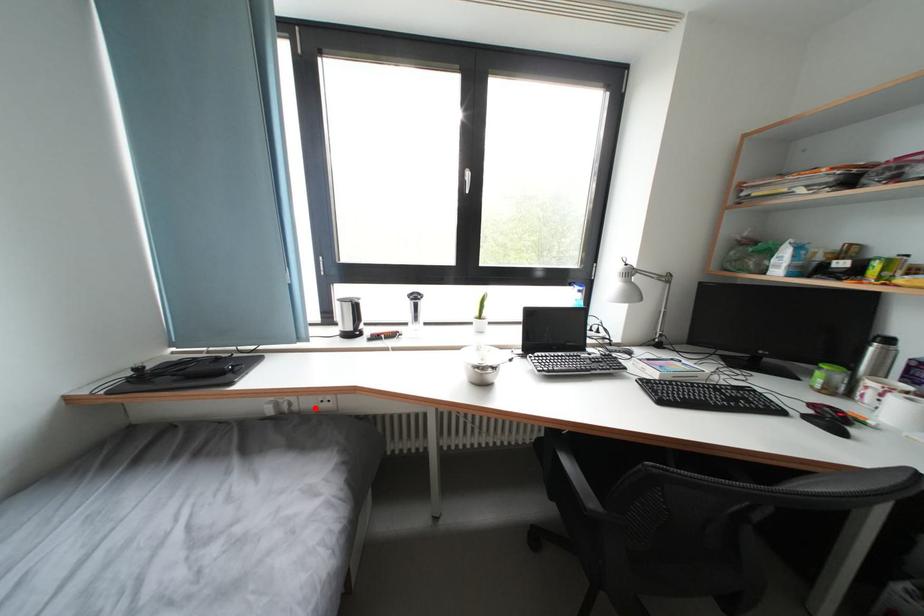
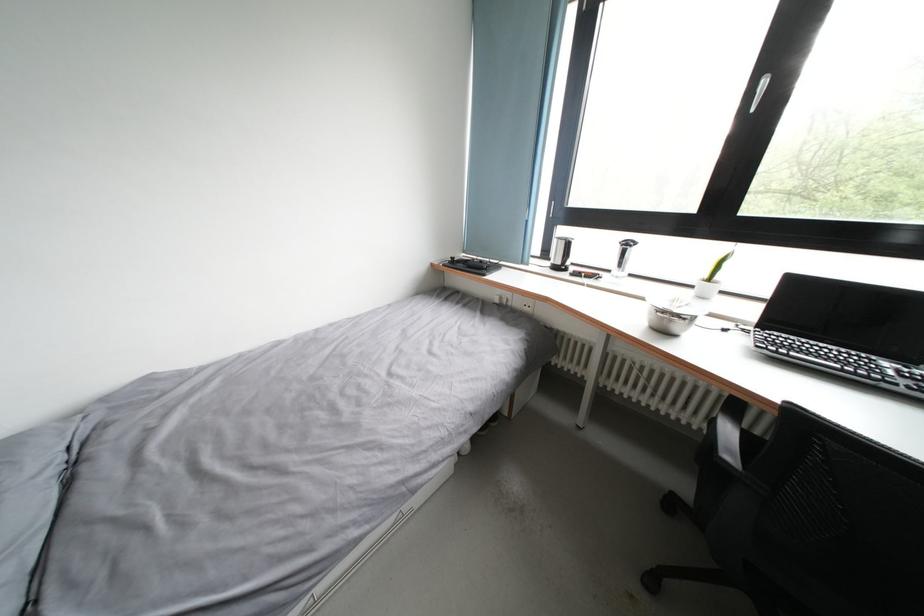
In the second image, find the point that corresponds to the highlighted location in the first image.

(524, 308)